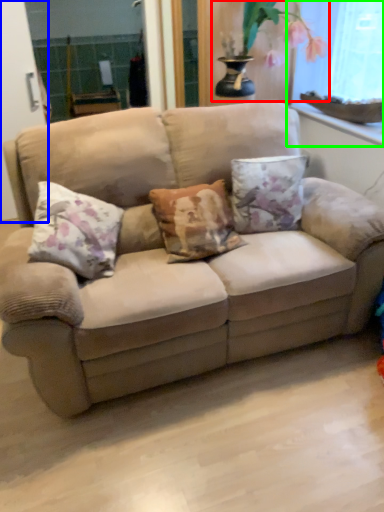
Question: Which is farther away from floral arrangement (highlighted by a red box)? screen door (highlighted by a blue box) or window screen (highlighted by a green box)?

Choices:
 (A) screen door
 (B) window screen

Answer: (A)